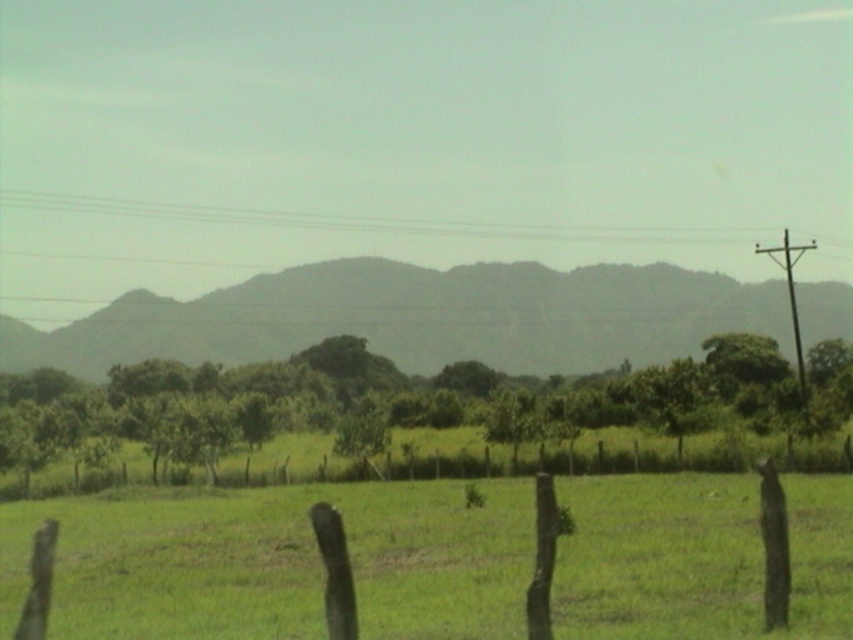
Consider the image. Does green grassy field at center have a larger size compared to green wooden fence at lower center?

Yes, green grassy field at center is bigger than green wooden fence at lower center.

Which is more to the left, green grassy field at center or green wooden fence at lower center?

green grassy field at center

Does point (828, 628) come behind point (625, 460)?

No.

Image resolution: width=853 pixels, height=640 pixels. Find the location of `green grassy field at center`. green grassy field at center is located at coordinates (277, 563).

Which is in front, point (33, 492) or point (618, 234)?

Positioned in front is point (33, 492).

Between green leafy tree at center and clear plastic power lines at upper center, which one appears on the left side from the viewer's perspective?

From the viewer's perspective, clear plastic power lines at upper center appears more on the left side.

The image size is (853, 640). What are the coordinates of `green leafy tree at center` in the screenshot? It's located at (416, 419).

Who is positioned more to the right, green grassy field at center or gray textured mountain at center?

Positioned to the right is green grassy field at center.

How far apart are green grassy field at center and gray textured mountain at center?

green grassy field at center is 117.06 meters away from gray textured mountain at center.

This screenshot has width=853, height=640. What do you see at coordinates (277, 563) in the screenshot?
I see `green grassy field at center` at bounding box center [277, 563].

Find the location of `green grassy field at center`. green grassy field at center is located at coordinates 277,563.